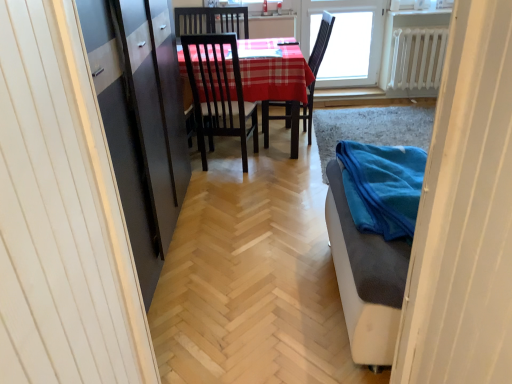
Question: Is transparent glass window at upper center wider than blue fabric at lower right?

Choices:
 (A) no
 (B) yes

Answer: (A)

Question: From the image's perspective, is transparent glass window at upper center below blue fabric at lower right?

Choices:
 (A) no
 (B) yes

Answer: (A)

Question: Does transparent glass window at upper center appear on the right side of blue fabric at lower right?

Choices:
 (A) no
 (B) yes

Answer: (B)

Question: Is the position of transparent glass window at upper center less distant than that of blue fabric at lower right?

Choices:
 (A) no
 (B) yes

Answer: (A)

Question: Is transparent glass window at upper center positioned beyond the bounds of blue fabric at lower right?

Choices:
 (A) no
 (B) yes

Answer: (B)

Question: From a real-world perspective, relative to transparent glass window at upper center, is blue fabric at lower right vertically above or below?

Choices:
 (A) below
 (B) above

Answer: (A)

Question: From the image's perspective, is blue fabric at lower right located above or below transparent glass window at upper center?

Choices:
 (A) below
 (B) above

Answer: (A)

Question: Is blue fabric at lower right inside the boundaries of transparent glass window at upper center, or outside?

Choices:
 (A) outside
 (B) inside

Answer: (A)

Question: Is blue fabric at lower right in front of or behind transparent glass window at upper center in the image?

Choices:
 (A) front
 (B) behind

Answer: (A)

Question: Based on their sizes in the image, would you say blue fabric at lower right is bigger or smaller than white metallic radiator at upper right?

Choices:
 (A) big
 (B) small

Answer: (A)

Question: From the image's perspective, is blue fabric at lower right located above or below white metallic radiator at upper right?

Choices:
 (A) above
 (B) below

Answer: (B)

Question: Based on their positions, is blue fabric at lower right located to the left or right of white metallic radiator at upper right?

Choices:
 (A) right
 (B) left

Answer: (B)

Question: Considering the positions of point (443, 142) and point (413, 41), is point (443, 142) closer or farther from the camera than point (413, 41)?

Choices:
 (A) closer
 (B) farther

Answer: (A)

Question: Is transparent glass window at upper center wider or thinner than blue fabric at lower right?

Choices:
 (A) wide
 (B) thin

Answer: (B)

Question: Would you say transparent glass window at upper center is inside or outside blue fabric at lower right?

Choices:
 (A) inside
 (B) outside

Answer: (B)